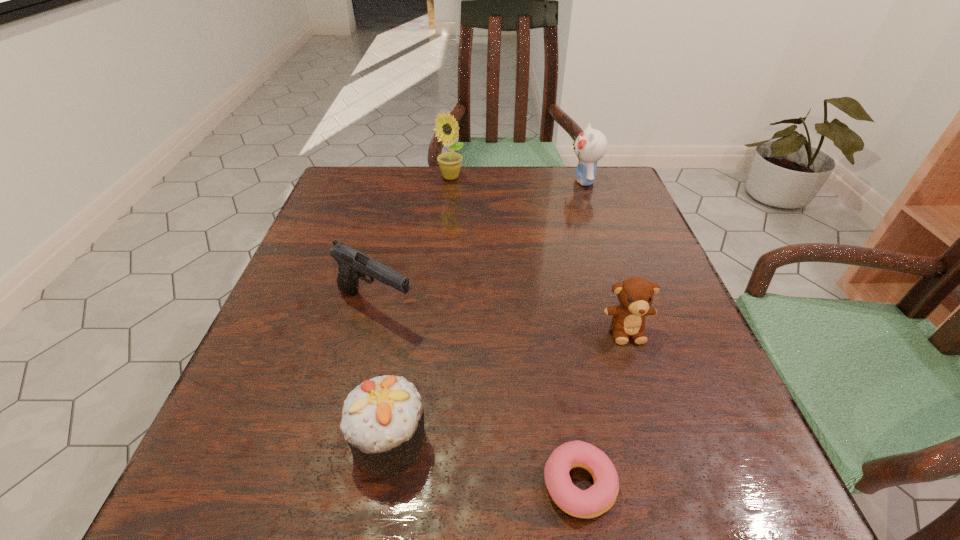
Locate which object is the fourth closest to the shortest object. Please provide its 2D coordinates. Your answer should be formatted as a tuple, i.e. [(x, y)], where the tuple contains the x and y coordinates of a point satisfying the conditions above.

[(590, 146)]

What are the coordinates of `object that is the third closest one to the kitten` in the screenshot? It's located at (353, 264).

Where is `vacant position in the image that satisfies the following two spatial constraints: 1. at the muzzle of the shortest object; 2. on the left side of the gun`? Image resolution: width=960 pixels, height=540 pixels. vacant position in the image that satisfies the following two spatial constraints: 1. at the muzzle of the shortest object; 2. on the left side of the gun is located at coordinates (330, 484).

Locate an element on the screen. This screenshot has width=960, height=540. vacant point that satisfies the following two spatial constraints: 1. on the front-facing side of the second tallest object; 2. on the face of the teddy bear is located at coordinates (635, 330).

Find the location of a particular element. free location that satisfies the following two spatial constraints: 1. on the face of the tallest object; 2. at the muzzle of the gun is located at coordinates (438, 306).

Identify the location of vacant area that satisfies the following two spatial constraints: 1. on the face of the sunflower; 2. on the right side of the doughnut. (420, 484).

Locate an element on the screen. The width and height of the screenshot is (960, 540). vacant position in the image that satisfies the following two spatial constraints: 1. on the face of the shortest object; 2. on the right side of the sunflower is located at coordinates (420, 484).

The width and height of the screenshot is (960, 540). In order to click on vacant point that satisfies the following two spatial constraints: 1. on the front-facing side of the fifth shortest object; 2. on the face of the teddy bear in this screenshot , I will do (x=635, y=330).